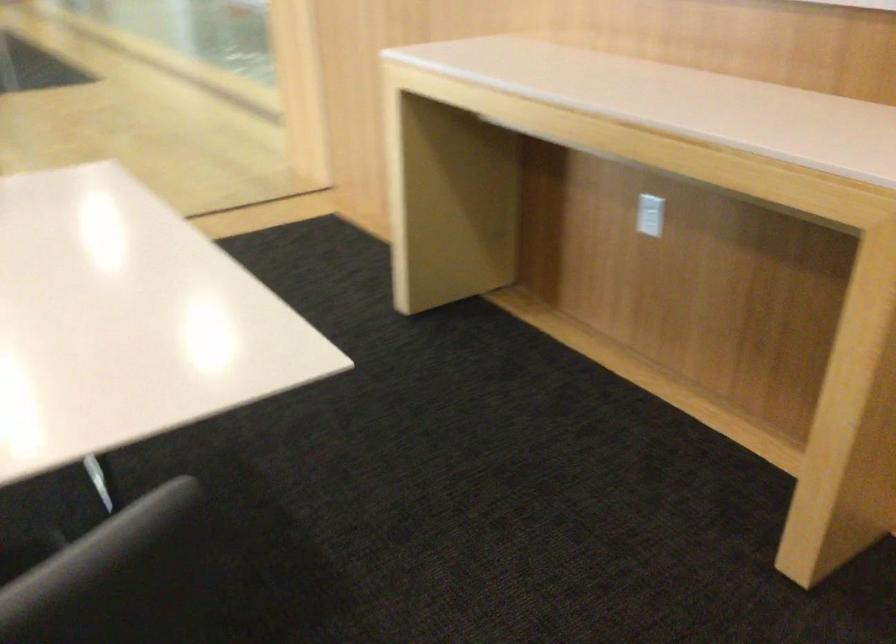
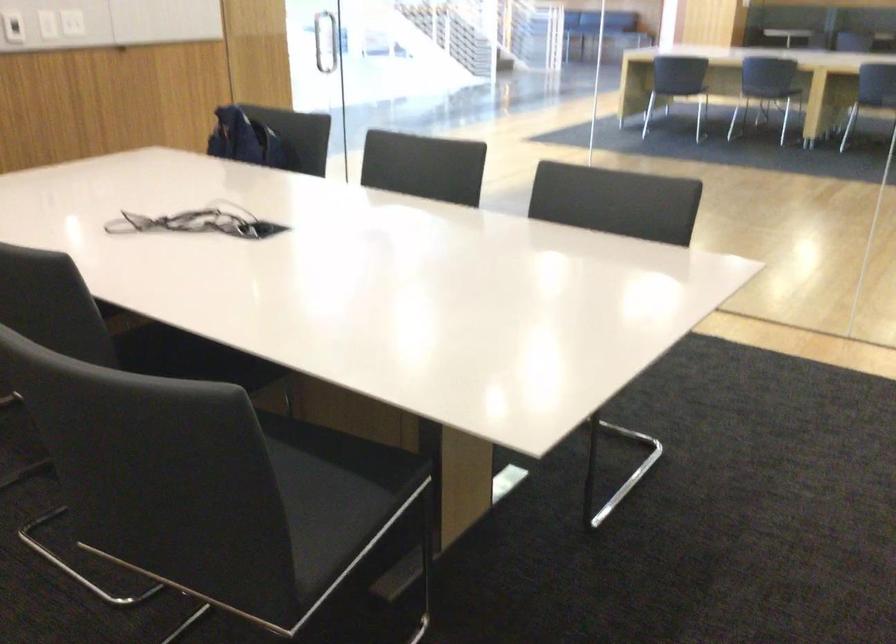
Question: The camera is either moving clockwise (left) or counter-clockwise (right) around the object. The first image is from the beginning of the video and the second image is from the end. Is the camera moving left or right when shooting the video?

Choices:
 (A) Left
 (B) Right

Answer: (B)